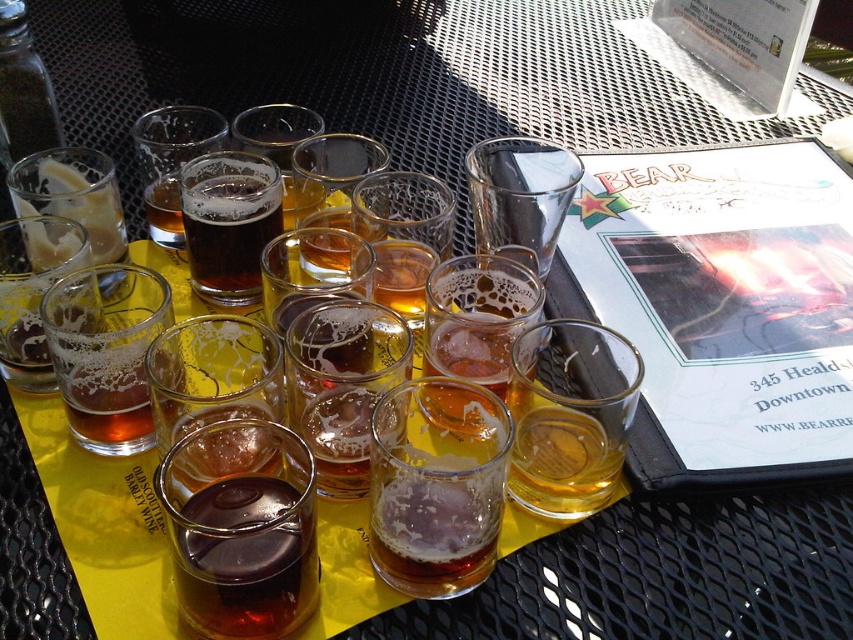
Which is behind, point (135, 355) or point (263, 184)?

Positioned behind is point (263, 184).

Is translucent frosted glass at center-left closer to the viewer compared to dark matte glass at center?

Yes.

What do you see at coordinates (106, 353) in the screenshot? The width and height of the screenshot is (853, 640). I see `translucent frosted glass at center-left` at bounding box center [106, 353].

Where is `translucent frosted glass at center-left`? This screenshot has width=853, height=640. translucent frosted glass at center-left is located at coordinates (106, 353).

Describe the element at coordinates (570, 417) in the screenshot. I see `translucent amber glass at center` at that location.

Can you confirm if translucent amber glass at center is positioned to the right of clear glass at center?

Yes, translucent amber glass at center is to the right of clear glass at center.

Describe the element at coordinates (570, 417) in the screenshot. I see `translucent amber glass at center` at that location.

Locate an element on the screen. Image resolution: width=853 pixels, height=640 pixels. translucent amber glass at center is located at coordinates (570, 417).

Who is more distant from viewer, (x=97, y=296) or (x=169, y=234)?

The point (x=169, y=234) is more distant.

Can you confirm if translucent frosted glass at center-left is shorter than matte glass beer at center?

Correct, translucent frosted glass at center-left is not as tall as matte glass beer at center.

You are a GUI agent. You are given a task and a screenshot of the screen. Output one action in this format:
    pyautogui.click(x=<x>, y=<y>)
    Task: Click on the translucent frosted glass at center-left
    
    Given the screenshot: What is the action you would take?
    pyautogui.click(x=106, y=353)